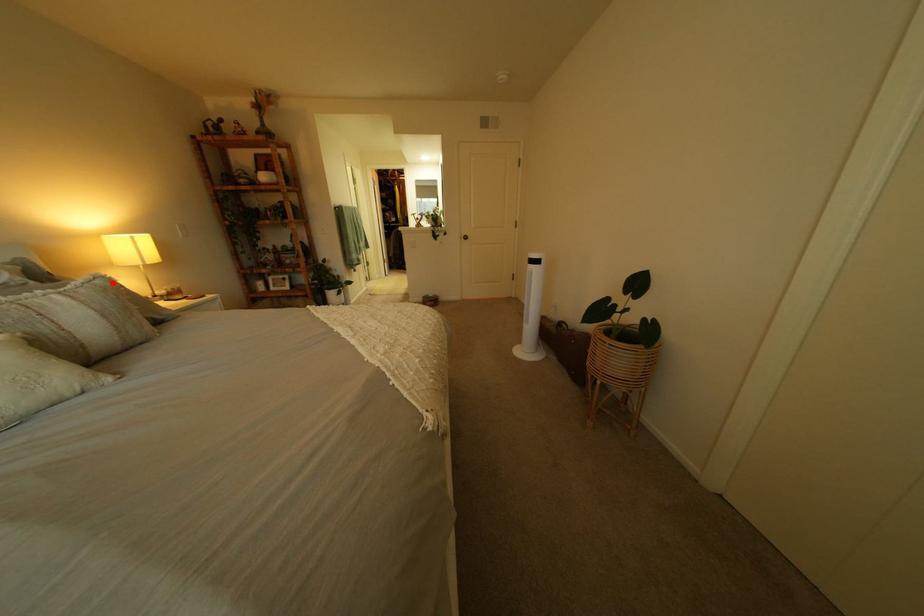
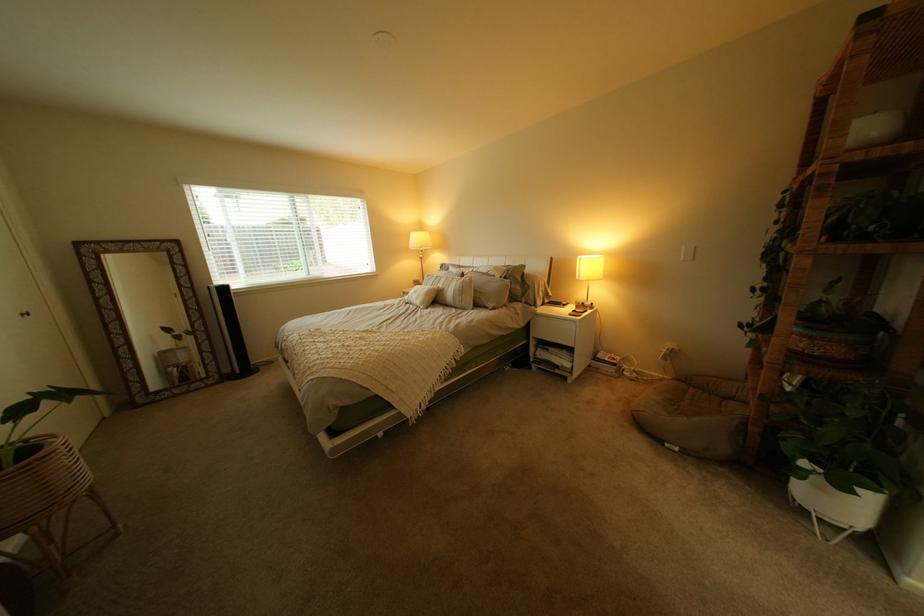
Question: I am providing you with two images of the same scene from different viewpoints. A red point is marked on the first image. Is the red point's position out of view in image 2?

Choices:
 (A) Yes
 (B) No

Answer: (B)